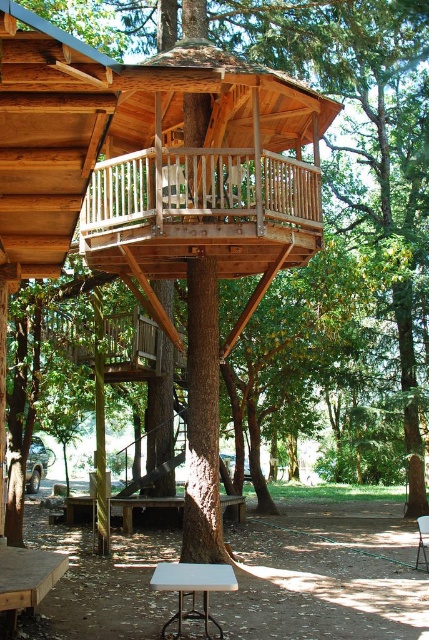
Question: Is wooden picnic table at center bigger than white fabric chair at center?

Choices:
 (A) no
 (B) yes

Answer: (B)

Question: Which of these objects is positioned farthest from the wooden picnic table at center?

Choices:
 (A) white plastic picnic table at lower left
 (B) white fabric chair at center

Answer: (A)

Question: Which point appears farthest from the camera in this image?

Choices:
 (A) (175, 502)
 (B) (181, 189)
 (C) (18, 604)
 (D) (166, 586)

Answer: (A)

Question: Is white plastic picnic table at lower left bigger than white plastic picnic table at lower center?

Choices:
 (A) yes
 (B) no

Answer: (B)

Question: Is white plastic picnic table at lower left smaller than white plastic picnic table at lower center?

Choices:
 (A) no
 (B) yes

Answer: (B)

Question: Which point is closer to the camera?

Choices:
 (A) (27, 560)
 (B) (114, 499)

Answer: (A)